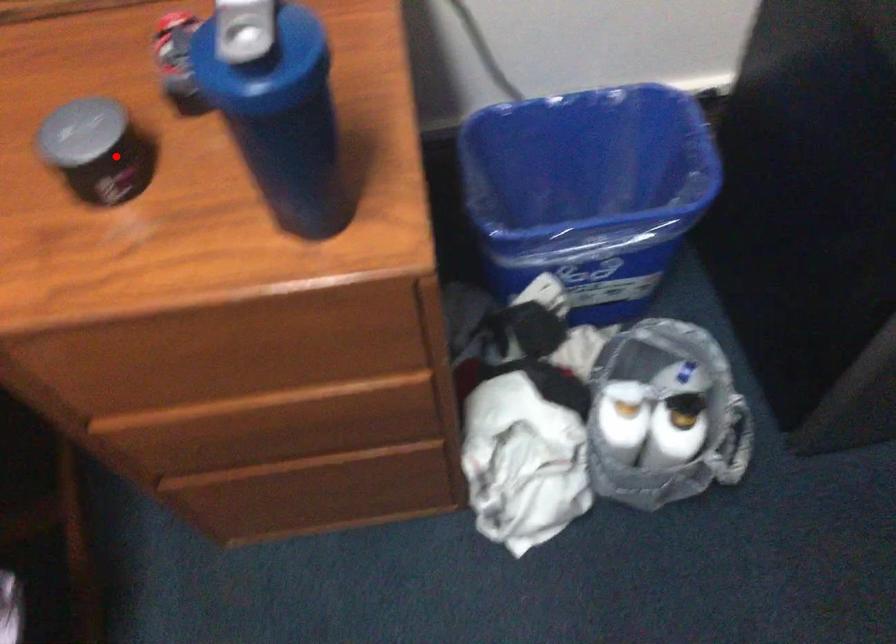
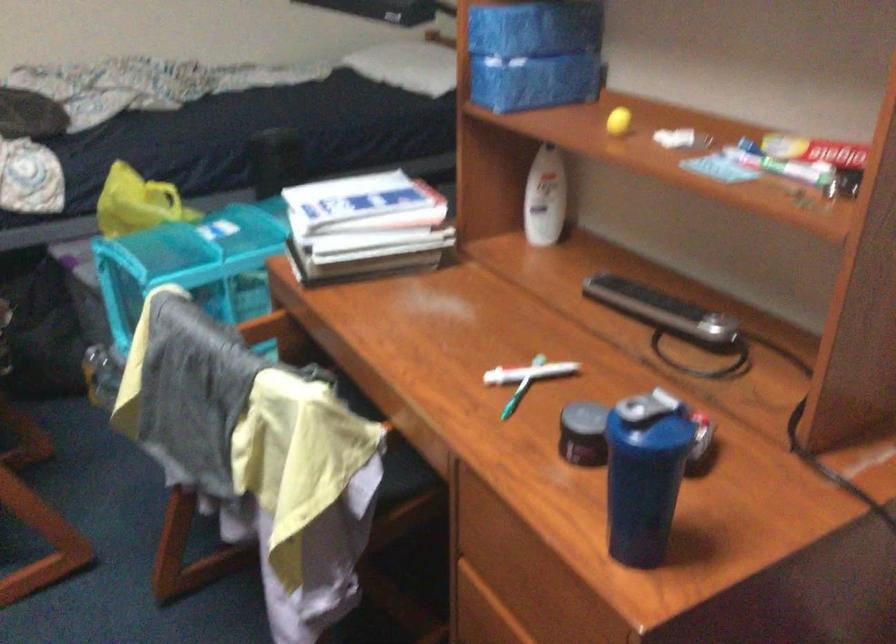
Question: I am providing you with two images of the same scene from different viewpoints. A red point is shown in image1. For the corresponding object point in image2, is it positioned nearer or farther from the camera?

Choices:
 (A) Nearer
 (B) Farther

Answer: (B)